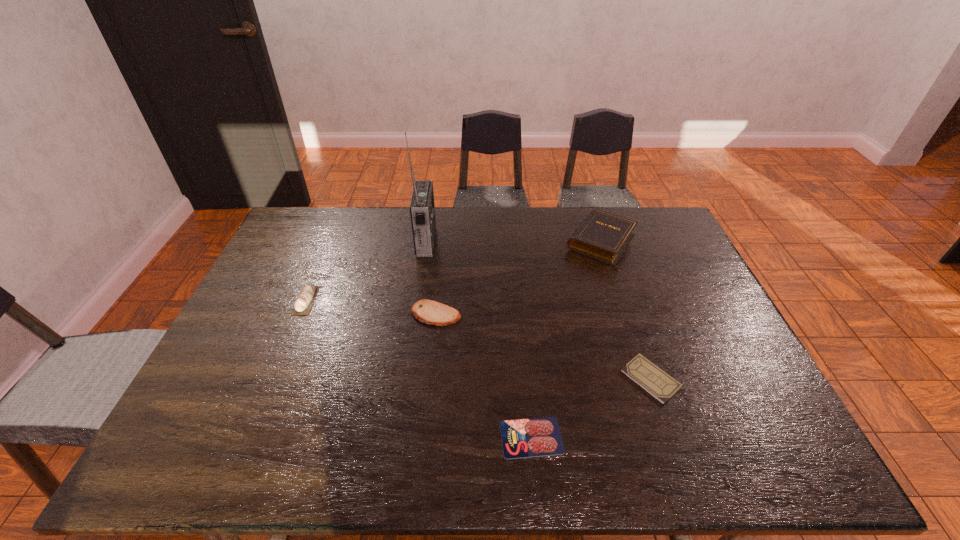
The image size is (960, 540). Find the location of `object present at the right edge`. object present at the right edge is located at coordinates (603, 236).

You are a GUI agent. You are given a task and a screenshot of the screen. Output one action in this format:
    pyautogui.click(x=<x>, y=<y>)
    Task: Click on the object located in the far right corner section of the desktop
    Image resolution: width=960 pixels, height=540 pixels.
    Given the screenshot: What is the action you would take?
    pyautogui.click(x=603, y=236)

In the image, there is a desktop. Find the location of `blank space at the far edge`. blank space at the far edge is located at coordinates (509, 224).

In the image, there is a desktop. Where is `vacant space at the left edge`? The width and height of the screenshot is (960, 540). vacant space at the left edge is located at coordinates (247, 360).

In the image, there is a desktop. At what (x,y) coordinates should I click in order to perform the action: click on vacant space at the right edge. Please return your answer as a coordinate pair (x, y). This screenshot has height=540, width=960. Looking at the image, I should click on (666, 263).

Locate an element on the screen. The width and height of the screenshot is (960, 540). free spot at the far left corner of the desktop is located at coordinates (313, 233).

In the image, there is a desktop. Identify the location of blank space at the far right corner. (660, 237).

This screenshot has width=960, height=540. Find the location of `vacant space at the near right corner`. vacant space at the near right corner is located at coordinates (777, 461).

Where is `vacant area between the Bible and the fourth object from left to right`? This screenshot has height=540, width=960. vacant area between the Bible and the fourth object from left to right is located at coordinates (565, 339).

Find the location of a particular element. vacant area that lies between the fourth tallest object and the shortest object is located at coordinates (484, 376).